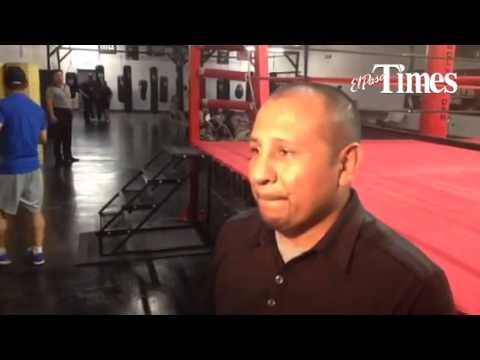
The image size is (480, 360). Identify the location of second black stair. (142, 202).